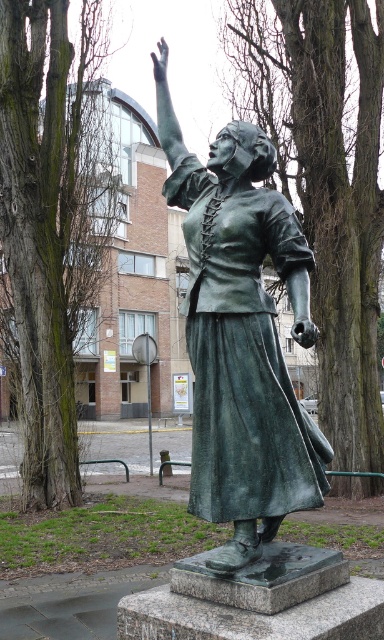
Does green patina statue at center have a lesser width compared to green textured tree at center?

Indeed, green patina statue at center has a lesser width compared to green textured tree at center.

Between green patina statue at center and green textured tree at center, which one appears on the left side from the viewer's perspective?

Positioned to the left is green patina statue at center.

Is point (231, 275) more distant than point (342, 84)?

No, it is not.

Locate an element on the screen. green patina statue at center is located at coordinates (241, 333).

Is green textured tree at center thinner than green mossy bark tree at left?

No.

Does point (299, 44) come behind point (13, 150)?

Yes, it is.

Between point (324, 161) and point (34, 500), which one is positioned in front?

Point (34, 500) is more forward.

You are a GUI agent. You are given a task and a screenshot of the screen. Output one action in this format:
    pyautogui.click(x=<x>, y=<y>)
    Task: Click on the green textured tree at center
    This screenshot has height=640, width=384.
    Given the screenshot: What is the action you would take?
    pyautogui.click(x=324, y=182)

Which of these two, green patina statue at center or green mossy bark tree at left, stands shorter?

Standing shorter between the two is green mossy bark tree at left.

Does green patina statue at center appear over green mossy bark tree at left?

Actually, green patina statue at center is below green mossy bark tree at left.

Locate an element on the screen. The image size is (384, 640). green patina statue at center is located at coordinates (241, 333).